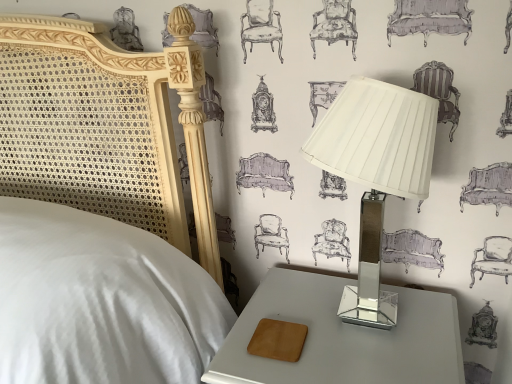
Question: From the image's perspective, is metallic gray nightstand at lower right on metallic silver lamp at right?

Choices:
 (A) no
 (B) yes

Answer: (A)

Question: Can you confirm if metallic gray nightstand at lower right is shorter than metallic silver lamp at right?

Choices:
 (A) yes
 (B) no

Answer: (A)

Question: From a real-world perspective, does metallic gray nightstand at lower right stand above metallic silver lamp at right?

Choices:
 (A) yes
 (B) no

Answer: (B)

Question: Considering the relative sizes of metallic gray nightstand at lower right and metallic silver lamp at right in the image provided, is metallic gray nightstand at lower right thinner than metallic silver lamp at right?

Choices:
 (A) yes
 (B) no

Answer: (B)

Question: Could metallic silver lamp at right be considered to be inside metallic gray nightstand at lower right?

Choices:
 (A) no
 (B) yes

Answer: (A)

Question: Could you tell me if metallic gray nightstand at lower right is facing metallic silver lamp at right?

Choices:
 (A) yes
 (B) no

Answer: (B)

Question: Are metallic silver lamp at right and metallic gray nightstand at lower right beside each other?

Choices:
 (A) yes
 (B) no

Answer: (B)

Question: Is metallic silver lamp at right positioned with its back to metallic gray nightstand at lower right?

Choices:
 (A) yes
 (B) no

Answer: (B)

Question: Does metallic silver lamp at right have a larger size compared to metallic gray nightstand at lower right?

Choices:
 (A) no
 (B) yes

Answer: (A)

Question: Does metallic silver lamp at right have a lesser width compared to metallic gray nightstand at lower right?

Choices:
 (A) no
 (B) yes

Answer: (B)

Question: Does metallic silver lamp at right have a greater width compared to metallic gray nightstand at lower right?

Choices:
 (A) yes
 (B) no

Answer: (B)

Question: Does metallic silver lamp at right come in front of metallic gray nightstand at lower right?

Choices:
 (A) no
 (B) yes

Answer: (B)

Question: Considering the positions of point (368, 170) and point (428, 327), is point (368, 170) closer or farther from the camera than point (428, 327)?

Choices:
 (A) farther
 (B) closer

Answer: (B)